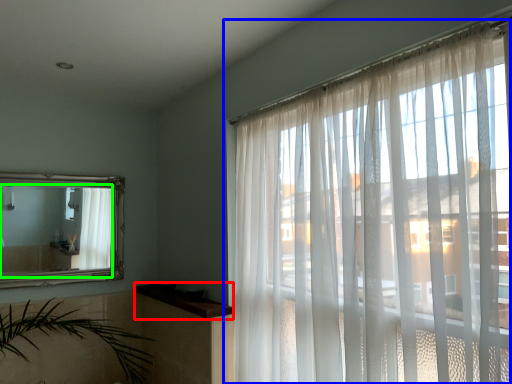
Question: Which object is positioned closest to window sill (highlighted by a red box)? Select from window (highlighted by a blue box) and mirror (highlighted by a green box).

Choices:
 (A) window
 (B) mirror

Answer: (B)